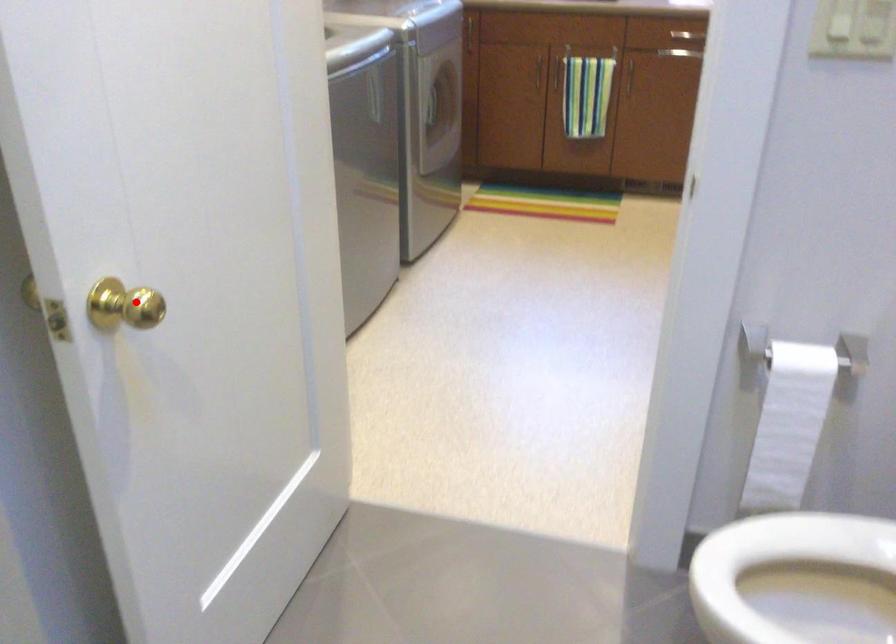
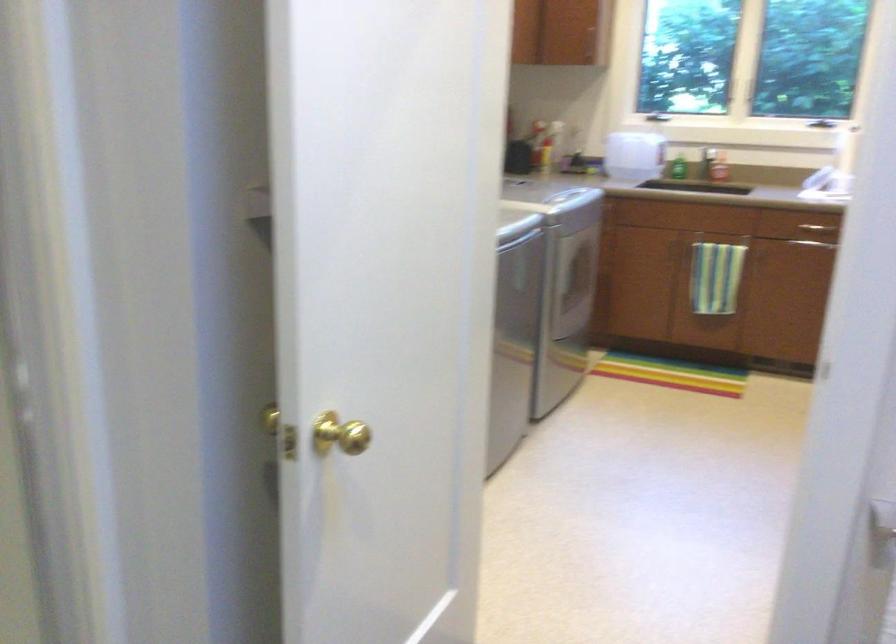
In the second image, find the point that corresponds to the highlighted location in the first image.

(339, 433)